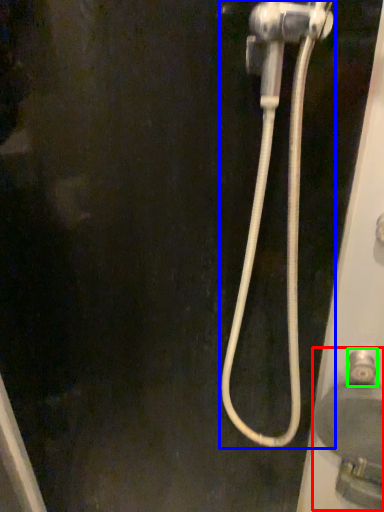
Question: Which is farther away from sink (highlighted by a red box)? plumbing fixture (highlighted by a blue box) or faucet (highlighted by a green box)?

Choices:
 (A) plumbing fixture
 (B) faucet

Answer: (A)